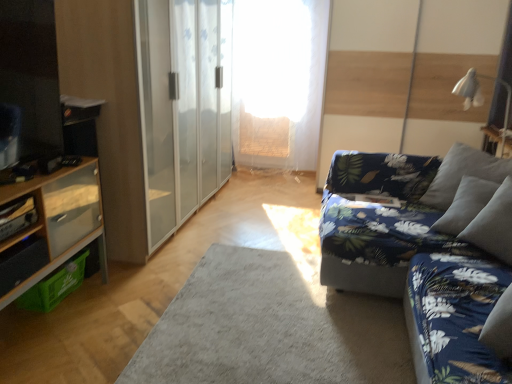
Question: Does blue floral fabric couch at right contain wooden cabinet at left?

Choices:
 (A) yes
 (B) no

Answer: (B)

Question: Is blue floral fabric couch at right positioned with its back to wooden cabinet at left?

Choices:
 (A) no
 (B) yes

Answer: (A)

Question: From the image's perspective, is blue floral fabric couch at right located beneath wooden cabinet at left?

Choices:
 (A) yes
 (B) no

Answer: (B)

Question: From a real-world perspective, is blue floral fabric couch at right below wooden cabinet at left?

Choices:
 (A) no
 (B) yes

Answer: (A)

Question: Considering the relative sizes of blue floral fabric couch at right and wooden cabinet at left in the image provided, is blue floral fabric couch at right shorter than wooden cabinet at left?

Choices:
 (A) yes
 (B) no

Answer: (A)

Question: Is white fabric lampshade at upper right bigger or smaller than wooden shelf at left?

Choices:
 (A) small
 (B) big

Answer: (B)

Question: Considering the positions of point pyautogui.click(x=479, y=74) and point pyautogui.click(x=7, y=220), is point pyautogui.click(x=479, y=74) closer or farther from the camera than point pyautogui.click(x=7, y=220)?

Choices:
 (A) farther
 (B) closer

Answer: (A)

Question: Would you say white fabric lampshade at upper right is inside or outside wooden shelf at left?

Choices:
 (A) inside
 (B) outside

Answer: (B)

Question: Is white fabric lampshade at upper right taller or shorter than wooden shelf at left?

Choices:
 (A) short
 (B) tall

Answer: (B)

Question: Is point (214, 29) closer or farther from the camera than point (459, 82)?

Choices:
 (A) farther
 (B) closer

Answer: (B)

Question: Is transparent glass barn door at center bigger or smaller than white fabric lampshade at upper right?

Choices:
 (A) small
 (B) big

Answer: (B)

Question: From a real-world perspective, relative to white fabric lampshade at upper right, is transparent glass barn door at center vertically above or below?

Choices:
 (A) below
 (B) above

Answer: (A)

Question: From the image's perspective, is transparent glass barn door at center located above or below white fabric lampshade at upper right?

Choices:
 (A) below
 (B) above

Answer: (B)

Question: Is blue floral fabric couch at right wider or thinner than transparent glass barn door at center?

Choices:
 (A) wide
 (B) thin

Answer: (A)

Question: Is blue floral fabric couch at right to the left or to the right of transparent glass barn door at center in the image?

Choices:
 (A) right
 (B) left

Answer: (A)